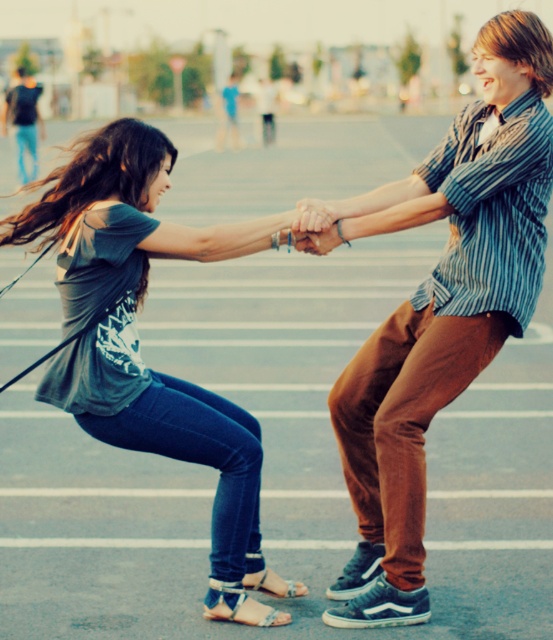
Question: Which point is closer to the camera?

Choices:
 (A) (540, 227)
 (B) (41, 138)
 (C) (168, 156)
 (D) (253, 586)

Answer: (A)

Question: Which of the following is the closest to the observer?

Choices:
 (A) (246, 604)
 (B) (424, 317)

Answer: (A)

Question: Is matte gray shirt at center below dark blue jeans at upper left?

Choices:
 (A) no
 (B) yes

Answer: (B)

Question: Which point is closer to the camera?

Choices:
 (A) (39, 116)
 (B) (211, 596)
 (C) (260, 576)

Answer: (B)

Question: Is blue fabric sandal at lower center below dark blue jeans at upper left?

Choices:
 (A) no
 (B) yes

Answer: (B)

Question: Can you confirm if matte gray shirt at center is positioned above matte gray t-shirt at center?

Choices:
 (A) yes
 (B) no

Answer: (A)